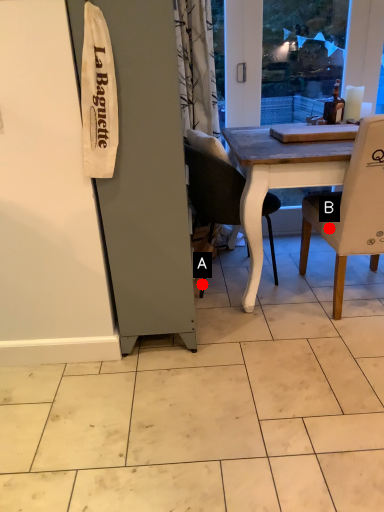
Question: Two points are circled on the image, labeled by A and B beside each circle. Which point appears farthest from the camera in this image?

Choices:
 (A) A is further
 (B) B is further

Answer: (A)